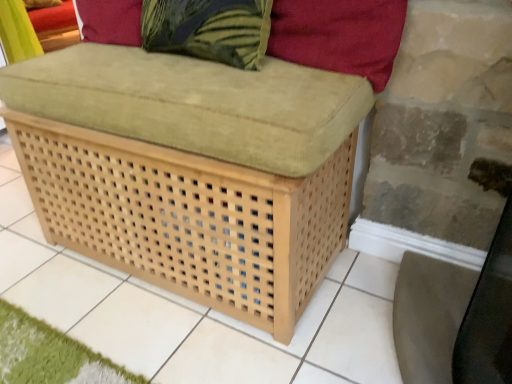
Question: Considering the relative sizes of green textured pillow at upper center and matte beige swivel chair at lower right in the image provided, is green textured pillow at upper center bigger than matte beige swivel chair at lower right?

Choices:
 (A) no
 (B) yes

Answer: (A)

Question: Is the depth of green textured pillow at upper center greater than that of matte beige swivel chair at lower right?

Choices:
 (A) yes
 (B) no

Answer: (A)

Question: From the image's perspective, is green textured pillow at upper center below matte beige swivel chair at lower right?

Choices:
 (A) yes
 (B) no

Answer: (B)

Question: From a real-world perspective, is green textured pillow at upper center on top of matte beige swivel chair at lower right?

Choices:
 (A) no
 (B) yes

Answer: (B)

Question: Is green textured pillow at upper center shorter than matte beige swivel chair at lower right?

Choices:
 (A) no
 (B) yes

Answer: (B)

Question: Based on their sizes in the image, would you say matte beige swivel chair at lower right is bigger or smaller than light brown woven ottoman at center?

Choices:
 (A) small
 (B) big

Answer: (A)

Question: From the image's perspective, relative to light brown woven ottoman at center, is matte beige swivel chair at lower right above or below?

Choices:
 (A) above
 (B) below

Answer: (B)

Question: Is matte beige swivel chair at lower right inside the boundaries of light brown woven ottoman at center, or outside?

Choices:
 (A) inside
 (B) outside

Answer: (B)

Question: Visually, is matte beige swivel chair at lower right positioned to the left or to the right of light brown woven ottoman at center?

Choices:
 (A) left
 (B) right

Answer: (B)

Question: Is matte beige swivel chair at lower right spatially inside velvet red pillow at upper right, or outside of it?

Choices:
 (A) outside
 (B) inside

Answer: (A)

Question: Visually, is matte beige swivel chair at lower right positioned to the left or to the right of velvet red pillow at upper right?

Choices:
 (A) left
 (B) right

Answer: (B)

Question: From the image's perspective, is matte beige swivel chair at lower right located above or below velvet red pillow at upper right?

Choices:
 (A) above
 (B) below

Answer: (B)

Question: Is matte beige swivel chair at lower right wider or thinner than velvet red pillow at upper right?

Choices:
 (A) thin
 (B) wide

Answer: (B)

Question: In terms of width, does velvet red pillow at upper right look wider or thinner when compared to matte beige swivel chair at lower right?

Choices:
 (A) thin
 (B) wide

Answer: (A)

Question: From the image's perspective, is velvet red pillow at upper right above or below matte beige swivel chair at lower right?

Choices:
 (A) below
 (B) above

Answer: (B)